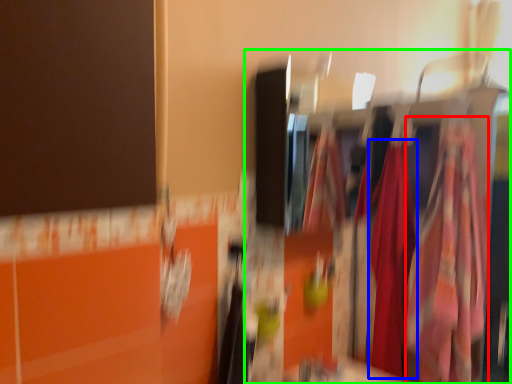
Question: Estimate the real-world distances between objects in this image. Which object is closer to clothing (highlighted by a red box), clothing (highlighted by a blue box) or closet (highlighted by a green box)?

Choices:
 (A) clothing
 (B) closet

Answer: (B)